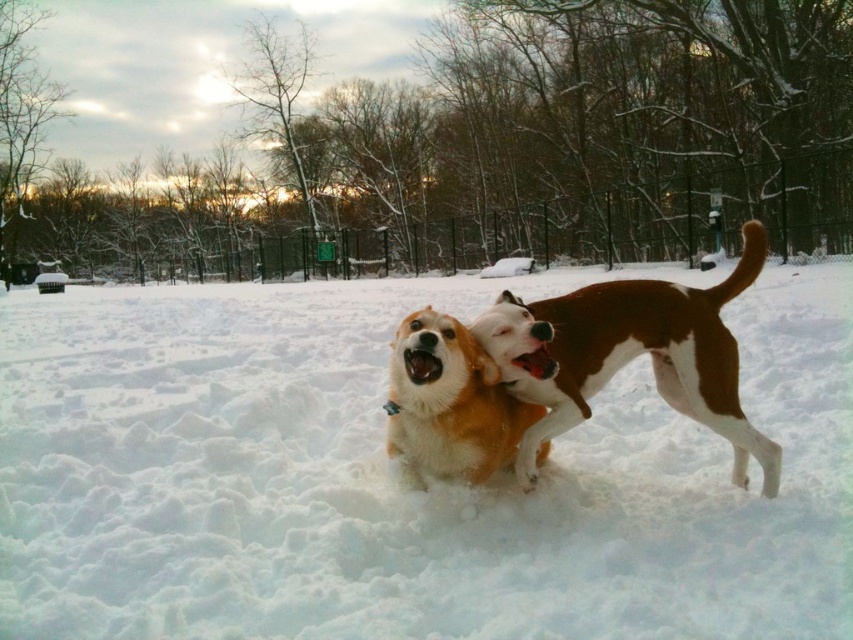
You are a photographer standing in the snowy park and want to take a photo of the two points marked in the scene. Which point, point (x=596, y=424) or point (x=459, y=404), is closer to your camera?

Point (x=459, y=404) is closer to the camera because it is less further than point (x=596, y=424) which is further away according to the description.

You are a photographer aiming to capture the soft fur dog at center in the snow. Since the white fluffy snow at center is above the dog, will the dog be mostly visible in your photo?

The white fluffy snow at center is above the soft fur dog at center, so the dog will be mostly visible as the snow is positioned above it and not covering the dog entirely.